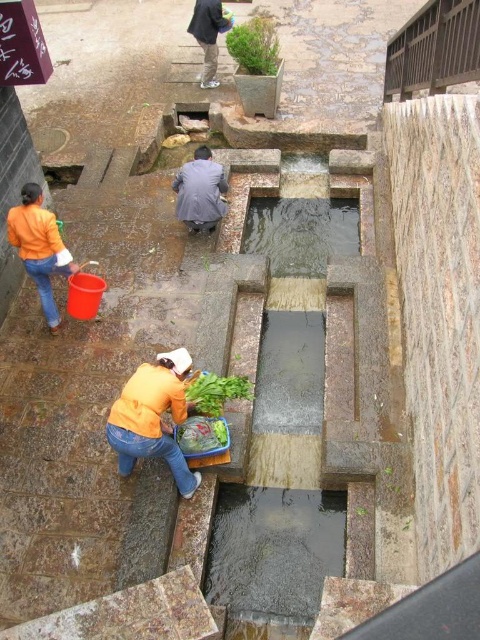
You are standing in front of the water channels and want to place a small plant pot between the two points marked as point (40,252) and point (204,380). Which point should the pot be closer to in order to be nearer to the viewer?

The pot should be closer to point (40,252) because it is further to the camera than point (204,380), making it closer to the viewer.

You are a customer in this market and want to buy the green leafy vegetable at center. However, there are green leafy vegetables at center in the way. Can you see the one you want?

The green leafy vegetable at center is in front of green leafy vegetables at center, so yes, you can see it.